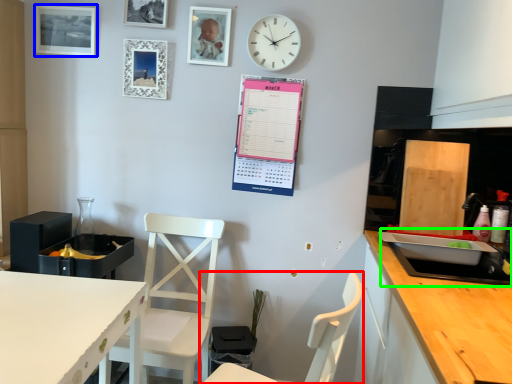
Question: Which is farther away from chair (highlighted by a red box)? picture frame (highlighted by a blue box) or sink (highlighted by a green box)?

Choices:
 (A) picture frame
 (B) sink

Answer: (A)